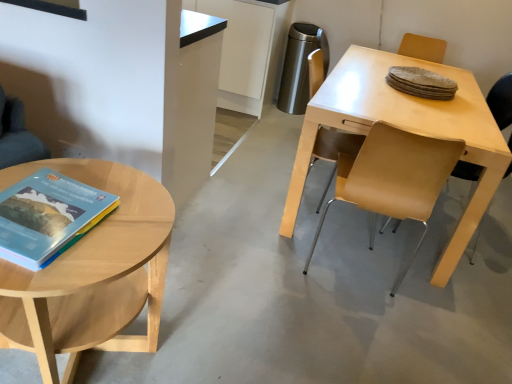
Locate an element on the screen. empty space that is ontop of light brown wood coffee table at left (from a real-world perspective) is located at coordinates (102, 210).